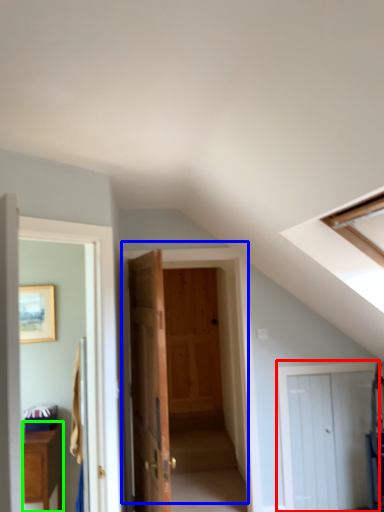
Question: Which object is the closest to the door (highlighted by a red box)? Choose among these: door (highlighted by a blue box) or cabinetry (highlighted by a green box).

Choices:
 (A) door
 (B) cabinetry

Answer: (A)